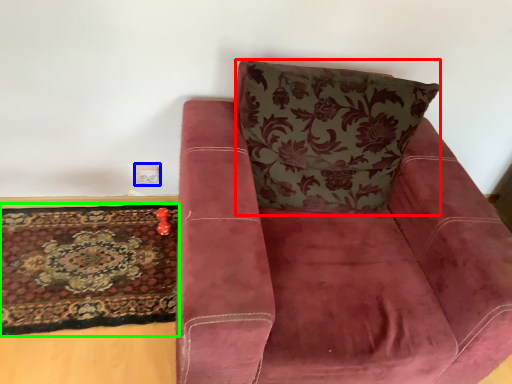
Question: Based on their relative distances, which object is farther from throw pillow (highlighted by a red box)? Choose from electric outlet (highlighted by a blue box) and mat (highlighted by a green box).

Choices:
 (A) electric outlet
 (B) mat

Answer: (A)